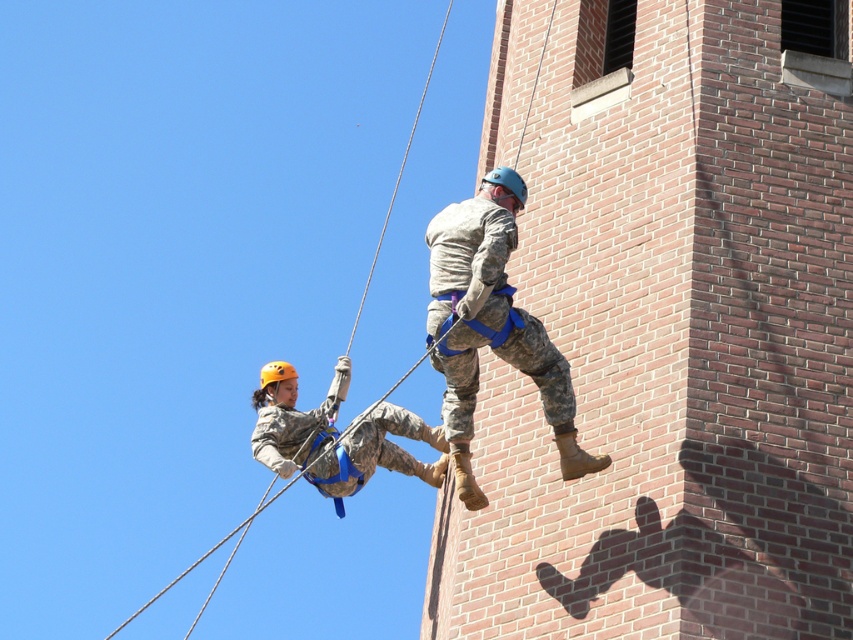
Question: From the image, what is the correct spatial relationship of camouflage fabric helmet at center in relation to rope at upper left?

Choices:
 (A) above
 (B) below

Answer: (B)

Question: Which point appears closest to the camera in this image?

Choices:
 (A) (460, 296)
 (B) (444, 440)

Answer: (A)

Question: Which point is farther to the camera?

Choices:
 (A) camouflage fabric uniform at center
 (B) rope at upper left
 (C) camouflage fabric helmet at center

Answer: (C)

Question: Can you confirm if camouflage fabric uniform at center is positioned to the left of camouflage fabric helmet at center?

Choices:
 (A) yes
 (B) no

Answer: (B)

Question: Is camouflage fabric helmet at center to the right of rope at upper left from the viewer's perspective?

Choices:
 (A) no
 (B) yes

Answer: (A)

Question: Estimate the real-world distances between objects in this image. Which object is closer to the camouflage fabric uniform at center?

Choices:
 (A) camouflage fabric helmet at center
 (B) rope at upper left

Answer: (A)